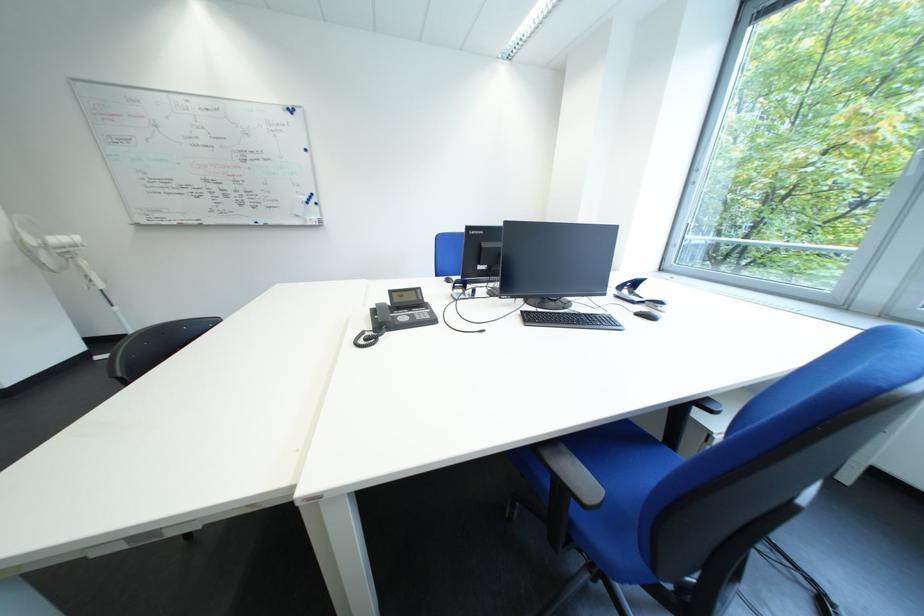
This screenshot has height=616, width=924. Describe the element at coordinates (420, 315) in the screenshot. I see `the telephone button` at that location.